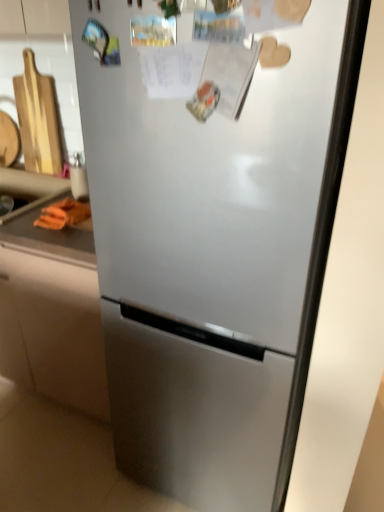
Question: Does orange fabric at left appear on the left side of orange fabric at left?

Choices:
 (A) no
 (B) yes

Answer: (A)

Question: Are orange fabric at left and orange fabric at left making contact?

Choices:
 (A) yes
 (B) no

Answer: (A)

Question: Is the position of orange fabric at left less distant than that of orange fabric at left?

Choices:
 (A) yes
 (B) no

Answer: (A)

Question: Considering the relative positions of orange fabric at left and orange fabric at left in the image provided, is orange fabric at left to the right of orange fabric at left from the viewer's perspective?

Choices:
 (A) no
 (B) yes

Answer: (B)

Question: Is orange fabric at left not inside orange fabric at left?

Choices:
 (A) yes
 (B) no

Answer: (A)

Question: From their relative heights in the image, would you say orange fabric at left is taller or shorter than orange fabric at left?

Choices:
 (A) tall
 (B) short

Answer: (B)

Question: Considering the positions of point (87, 216) and point (92, 252), is point (87, 216) closer or farther from the camera than point (92, 252)?

Choices:
 (A) farther
 (B) closer

Answer: (A)

Question: Considering the positions of orange fabric at left and orange fabric at left in the image, is orange fabric at left bigger or smaller than orange fabric at left?

Choices:
 (A) big
 (B) small

Answer: (B)

Question: From the image's perspective, is orange fabric at left positioned above or below orange fabric at left?

Choices:
 (A) below
 (B) above

Answer: (A)

Question: Relative to orange fabric at left, is orange fabric at left in front or behind?

Choices:
 (A) behind
 (B) front

Answer: (A)

Question: From a real-world perspective, is orange fabric at left positioned above or below orange fabric at left?

Choices:
 (A) above
 (B) below

Answer: (B)

Question: In terms of width, does orange fabric at left look wider or thinner when compared to orange fabric at left?

Choices:
 (A) thin
 (B) wide

Answer: (B)

Question: Considering the positions of orange fabric at left and orange fabric at left in the image, is orange fabric at left taller or shorter than orange fabric at left?

Choices:
 (A) short
 (B) tall

Answer: (B)

Question: Visually, is orange rubber at lower left positioned to the left or to the right of orange fabric at left?

Choices:
 (A) left
 (B) right

Answer: (A)

Question: Considering their positions, is orange rubber at lower left located in front of or behind orange fabric at left?

Choices:
 (A) behind
 (B) front

Answer: (A)